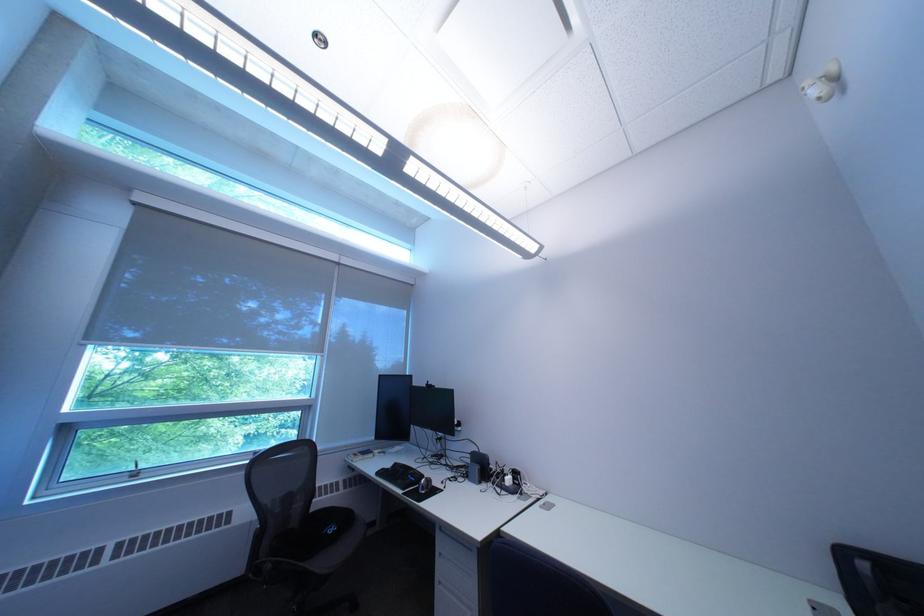
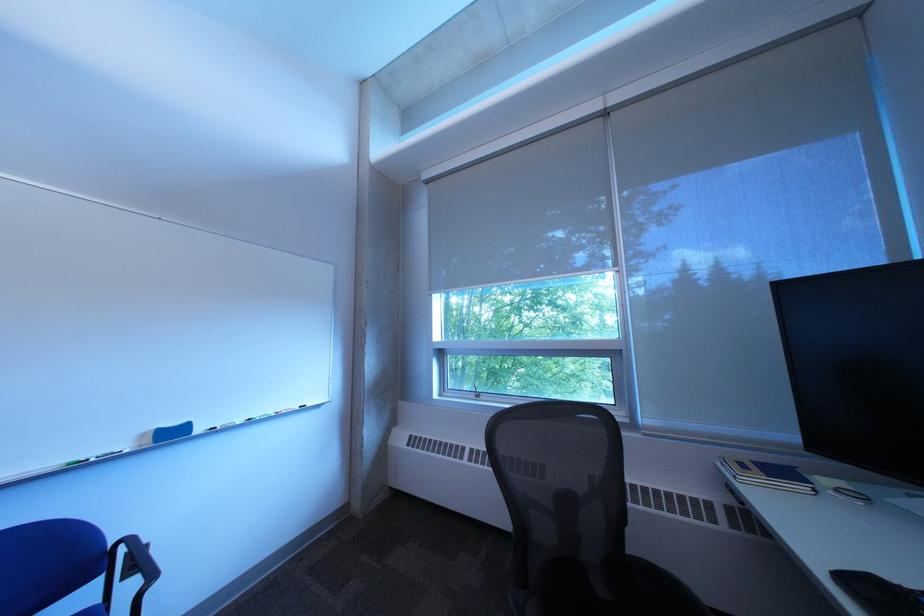
In the second image, find the point that corresponds to (x=360, y=462) in the first image.

(733, 468)